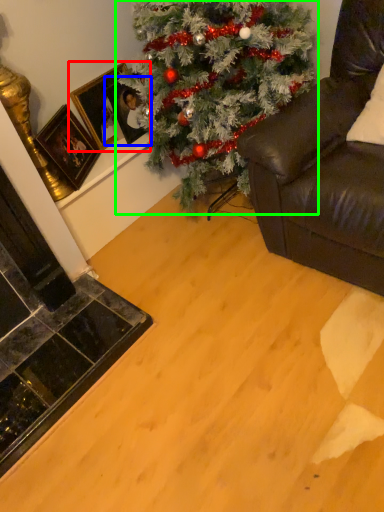
Question: Which is farther away from picture frame (highlighted by a red box)? picture frame (highlighted by a blue box) or christmas tree (highlighted by a green box)?

Choices:
 (A) picture frame
 (B) christmas tree

Answer: (B)